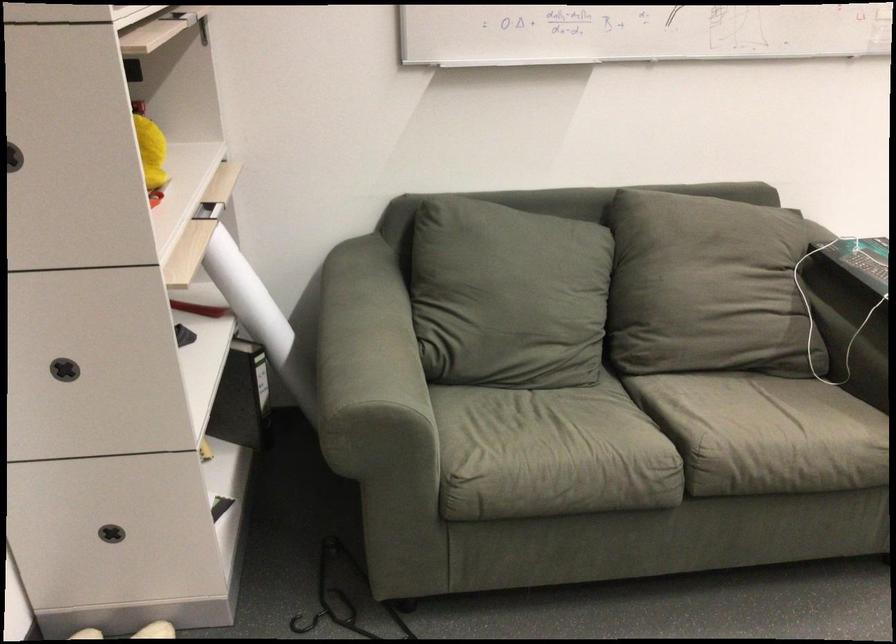
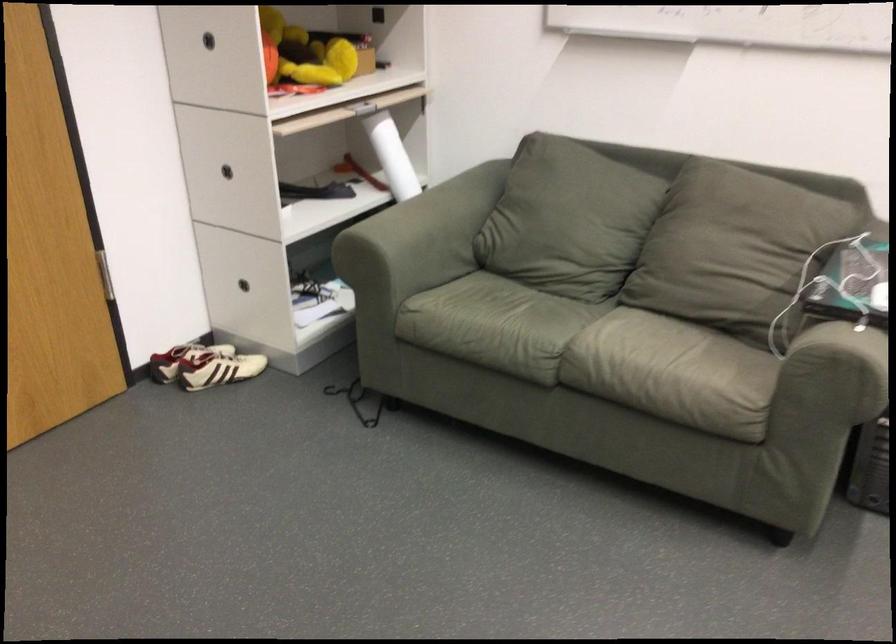
Question: I am providing you with two images of the same scene from different viewpoints. Please identify which objects are invisible in image2.

Choices:
 (A) black drawer handle
 (B) yellow stuffed toy
 (C) white and black shoe
 (D) none of these

Answer: (D)